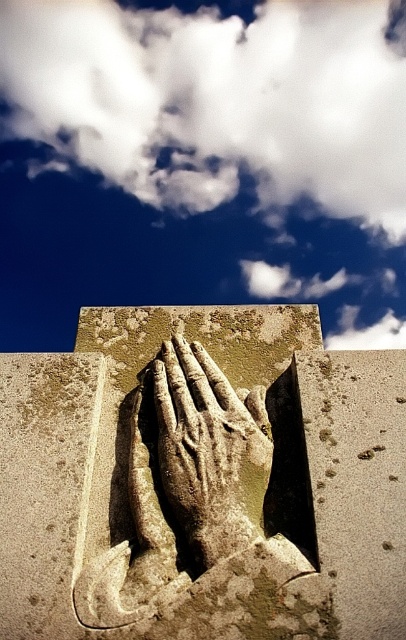
Is white fluffy cloud at upper center positioned behind rough stone hands at center?

Yes, white fluffy cloud at upper center is further from the viewer.

Does white fluffy cloud at upper center have a greater height compared to rough stone hands at center?

Yes, white fluffy cloud at upper center is taller than rough stone hands at center.

Locate an element on the screen. white fluffy cloud at upper center is located at coordinates (202, 161).

Can you confirm if white fluffy cloud at upper center is taller than rough stone hand at center?

Yes, white fluffy cloud at upper center is taller than rough stone hand at center.

Can you confirm if white fluffy cloud at upper center is wider than rough stone hand at center?

Yes.

The width and height of the screenshot is (406, 640). What do you see at coordinates (202, 161) in the screenshot?
I see `white fluffy cloud at upper center` at bounding box center [202, 161].

Where is `white fluffy cloud at upper center`? white fluffy cloud at upper center is located at coordinates (202, 161).

Looking at this image, which is below, rough stone hands at center or rough stone hand at center?

Positioned lower is rough stone hand at center.

Who is positioned more to the right, rough stone hands at center or rough stone hand at center?

rough stone hands at center is more to the right.

Image resolution: width=406 pixels, height=640 pixels. In order to click on rough stone hands at center in this screenshot , I will do `click(200, 508)`.